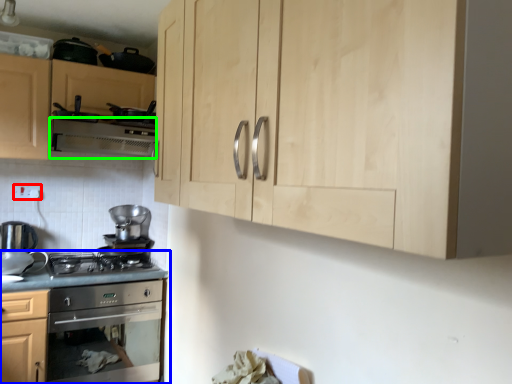
Question: Based on their relative distances, which object is farther from electric outlet (highlighted by a red box)? Choose from countertop (highlighted by a blue box) and exhaust hood (highlighted by a green box).

Choices:
 (A) countertop
 (B) exhaust hood

Answer: (A)